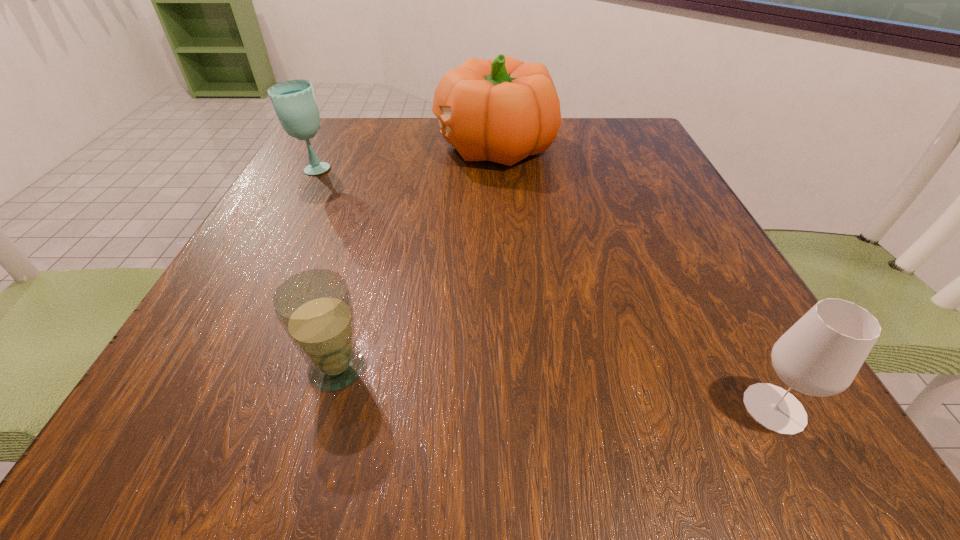
The image size is (960, 540). In order to click on vacant point located between the second object from left to right and the tallest object in this screenshot , I will do `click(416, 258)`.

Find the location of a particular element. This screenshot has width=960, height=540. free area in between the rightmost object and the second glass from left to right is located at coordinates (556, 389).

You are a GUI agent. You are given a task and a screenshot of the screen. Output one action in this format:
    pyautogui.click(x=<x>, y=<y>)
    Task: Click on the vacant point located between the third object from left to right and the rightmost object
    This screenshot has width=960, height=540.
    Given the screenshot: What is the action you would take?
    pyautogui.click(x=635, y=278)

Identify the location of vacant area between the second glass from left to right and the leftmost object. (325, 269).

Where is `empty space between the leftmost object and the shortest object`? empty space between the leftmost object and the shortest object is located at coordinates (325, 269).

The image size is (960, 540). Identify the location of vacant region between the third object from left to right and the rightmost object. (635, 278).

Select which object appears as the third closest to the leftmost object. Please provide its 2D coordinates. Your answer should be formatted as a tuple, i.e. [(x, y)], where the tuple contains the x and y coordinates of a point satisfying the conditions above.

[(820, 355)]

Locate an element on the screen. The image size is (960, 540). the third closest object to the leftmost glass is located at coordinates (820, 355).

Select which glass is the second closest to the tallest object. Please provide its 2D coordinates. Your answer should be formatted as a tuple, i.e. [(x, y)], where the tuple contains the x and y coordinates of a point satisfying the conditions above.

[(314, 307)]

Identify which glass is located as the second nearest to the shortest object. Please provide its 2D coordinates. Your answer should be formatted as a tuple, i.e. [(x, y)], where the tuple contains the x and y coordinates of a point satisfying the conditions above.

[(820, 355)]